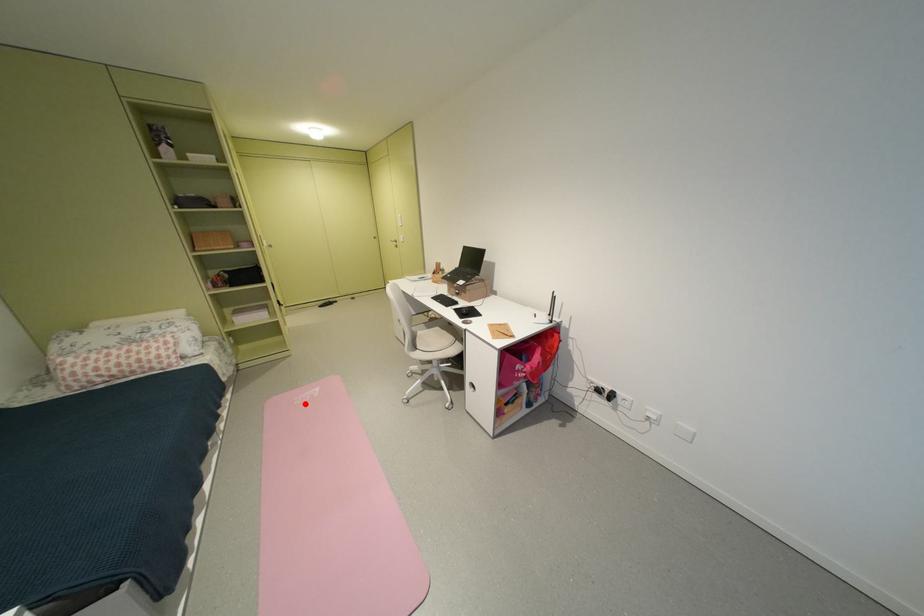
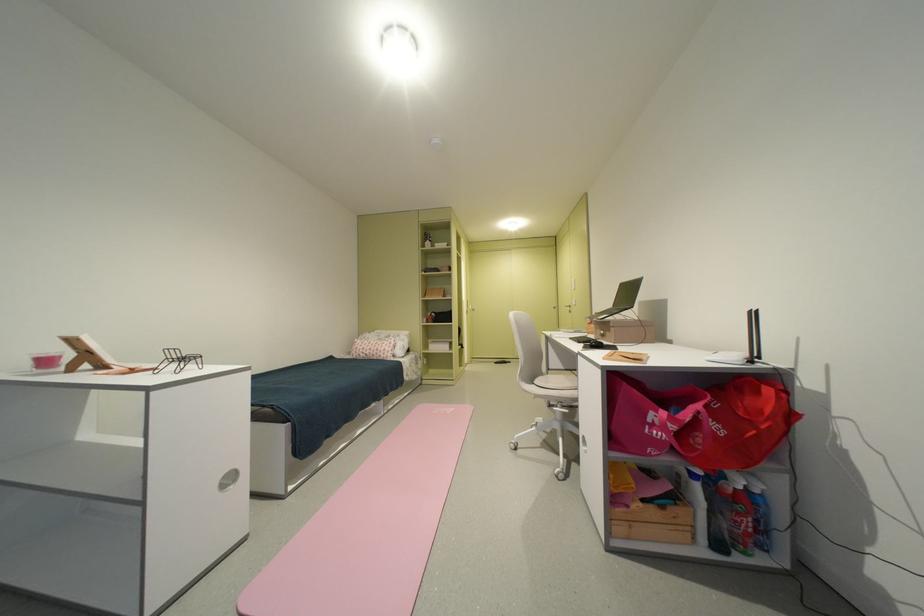
Locate, in the second image, the point that corresponds to the highlighted location in the first image.

(444, 413)